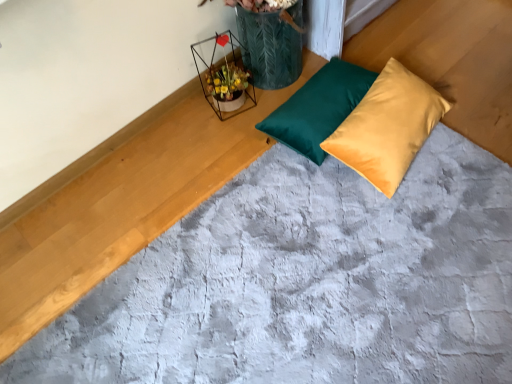
This screenshot has width=512, height=384. Identify the location of vacant area that is in front of metallic wire flower basket at upper center. (224, 139).